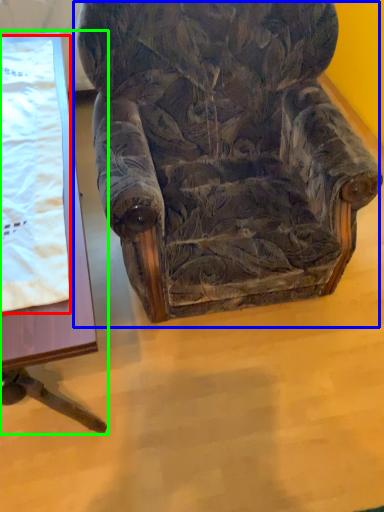
Question: Which object is positioned farthest from blanket (highlighted by a red box)? Select from chair (highlighted by a blue box) and table (highlighted by a green box).

Choices:
 (A) chair
 (B) table

Answer: (A)